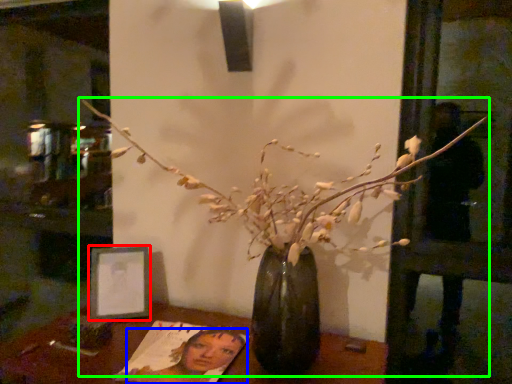
Question: Which is farther away from picture frame (highlighted by a red box)? woman (highlighted by a blue box) or houseplant (highlighted by a green box)?

Choices:
 (A) woman
 (B) houseplant

Answer: (B)